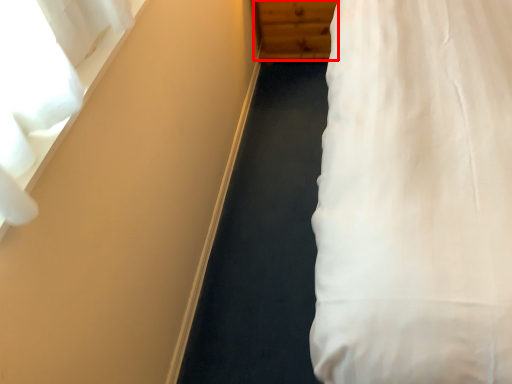
Question: In this image, where is dresser (annotated by the red box) located relative to curtain?

Choices:
 (A) right
 (B) left

Answer: (A)